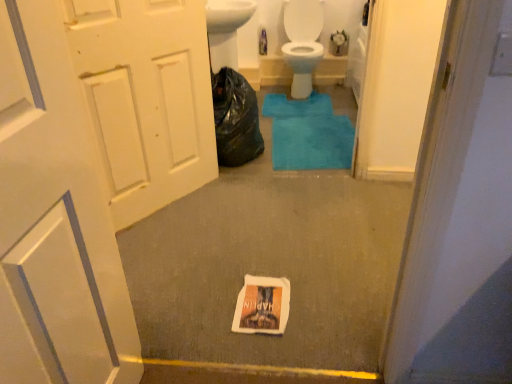
Question: Considering the positions of point (303, 72) and point (194, 87), is point (303, 72) closer or farther from the camera than point (194, 87)?

Choices:
 (A) closer
 (B) farther

Answer: (B)

Question: From a real-world perspective, is white glossy toilet at center physically located above or below white matte door at left, the first door from the back?

Choices:
 (A) above
 (B) below

Answer: (B)

Question: Which is farther from the white glossy toilet at center?

Choices:
 (A) teal plush bath mat at center
 (B) black plastic bag at center
 (C) white matte door at left, which appears as the second door when viewed from the front
 (D) white matte door at left, arranged as the second door when viewed from the back
 (E) white paper flyer at center

Answer: (D)

Question: Estimate the real-world distances between objects in this image. Which object is closer to the white matte door at left, arranged as the second door when viewed from the back?

Choices:
 (A) black plastic bag at center
 (B) white glossy toilet at center
 (C) white paper flyer at center
 (D) teal plush bath mat at center
 (E) white matte door at left, the first door from the back

Answer: (C)